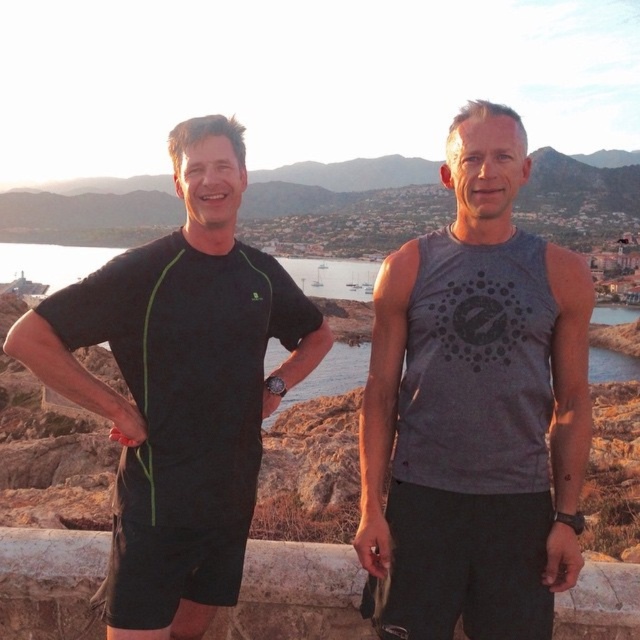
Which is below, gray matte tank top at center or stone at center?

stone at center

Which is behind, point (570, 388) or point (316, 579)?

The point (570, 388) is behind.

I want to click on gray matte tank top at center, so click(476, 406).

Between black matte t-shirt at left and stone at center, which one has more height?

black matte t-shirt at left

Who is shorter, black matte t-shirt at left or stone at center?

stone at center

Where is `black matte t-shirt at left`? The width and height of the screenshot is (640, 640). black matte t-shirt at left is located at coordinates (180, 387).

Can you confirm if gray matte tank top at center is wider than black matte t-shirt at left?

No.

Is gray matte tank top at center positioned in front of black matte t-shirt at left?

No, it is behind black matte t-shirt at left.

Between point (424, 385) and point (200, 209), which one is positioned in front?

Point (424, 385)

Identify the location of gray matte tank top at center. The width and height of the screenshot is (640, 640). (476, 406).